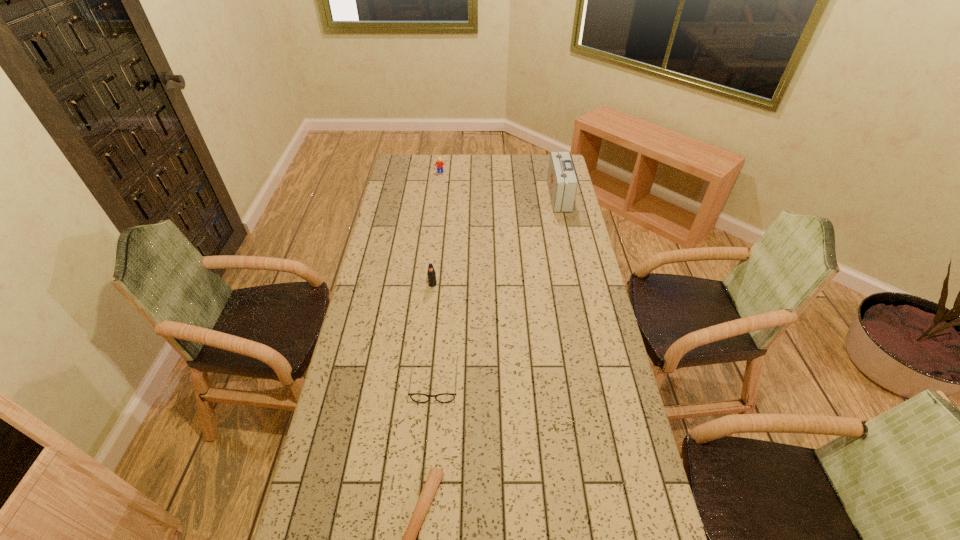
Locate an element on the screen. This screenshot has height=540, width=960. the fourth nearest object is located at coordinates (562, 183).

The height and width of the screenshot is (540, 960). What are the coordinates of `the first-aid kit` in the screenshot? It's located at (562, 183).

Find the location of `the third farthest object`. the third farthest object is located at coordinates click(431, 274).

Find the location of a particular element. The image size is (960, 540). the second tallest object is located at coordinates (431, 274).

The height and width of the screenshot is (540, 960). I want to click on Lego, so click(439, 163).

You are a GUI agent. You are given a task and a screenshot of the screen. Output one action in this format:
    pyautogui.click(x=<x>, y=<y>)
    Task: Click on the third tallest object
    The width and height of the screenshot is (960, 540).
    Given the screenshot: What is the action you would take?
    [x=439, y=163]

Locate an element on the screen. The width and height of the screenshot is (960, 540). the fourth tallest object is located at coordinates (416, 397).

Locate an element on the screen. The width and height of the screenshot is (960, 540). spectacles is located at coordinates (416, 397).

At what (x,y) coordinates should I click in order to perform the action: click on vacant space situated on the front-facing side of the rightmost object. Please return your answer as a coordinate pair (x, y). The height and width of the screenshot is (540, 960). Looking at the image, I should click on pyautogui.click(x=528, y=196).

This screenshot has width=960, height=540. I want to click on vacant area located 0.280m on the front-facing side of the rightmost object, so click(x=493, y=196).